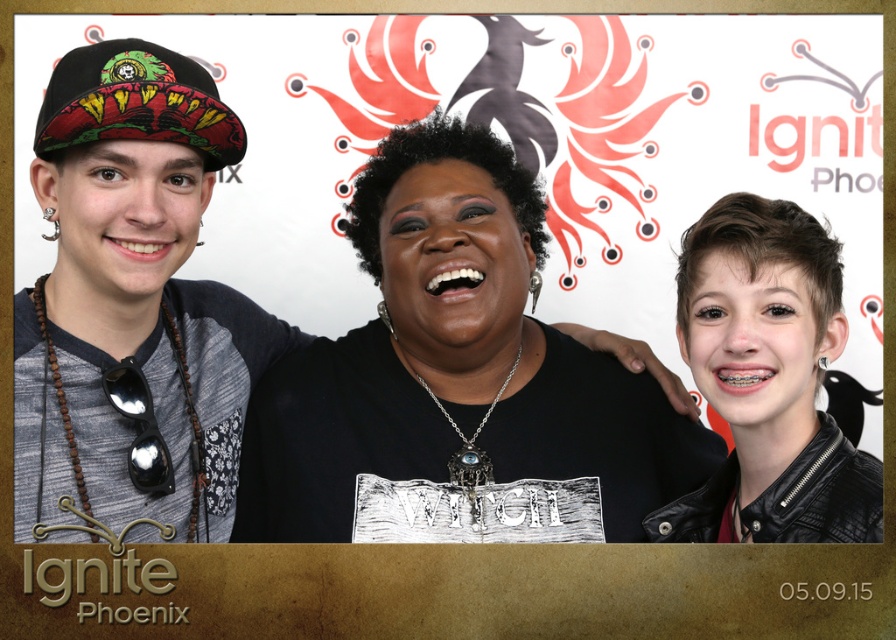
Question: Does denim jacket at left have a smaller size compared to black leather jacket at right?

Choices:
 (A) no
 (B) yes

Answer: (A)

Question: Can you confirm if denim jacket at left is bigger than black leather jacket at right?

Choices:
 (A) no
 (B) yes

Answer: (B)

Question: Is denim jacket at left further to camera compared to black leather jacket at right?

Choices:
 (A) no
 (B) yes

Answer: (A)

Question: Which object appears closest to the camera in this image?

Choices:
 (A) denim jacket at left
 (B) black leather jacket at right

Answer: (A)